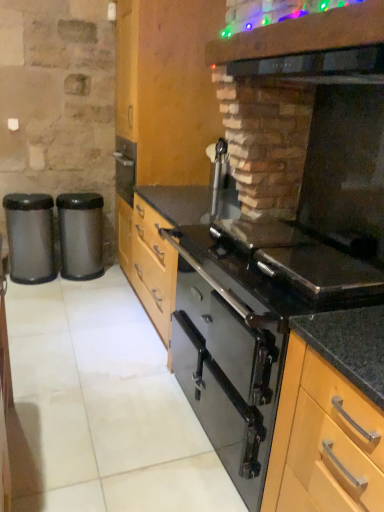
Question: Should I look upward or downward to see black glass oven at center?

Choices:
 (A) up
 (B) down

Answer: (B)

Question: From the image's perspective, is black glass oven at center over black glossy vent at upper center?

Choices:
 (A) yes
 (B) no

Answer: (B)

Question: From a real-world perspective, is black glass oven at center physically above black glossy vent at upper center?

Choices:
 (A) yes
 (B) no

Answer: (B)

Question: Does black glass oven at center come in front of black glossy vent at upper center?

Choices:
 (A) no
 (B) yes

Answer: (A)

Question: Can you confirm if black glass oven at center is bigger than black glossy vent at upper center?

Choices:
 (A) no
 (B) yes

Answer: (B)

Question: Is black glass oven at center far away from black glossy vent at upper center?

Choices:
 (A) no
 (B) yes

Answer: (A)

Question: Can you confirm if black glass oven at center is thinner than black glossy vent at upper center?

Choices:
 (A) yes
 (B) no

Answer: (B)

Question: Is metallic trash can at left, marked as the second waste container in a right-to-left arrangement, turned away from black glass exhaust hood at upper right?

Choices:
 (A) yes
 (B) no

Answer: (B)

Question: From the image's perspective, is metallic trash can at left, marked as the second waste container in a right-to-left arrangement, over black glass exhaust hood at upper right?

Choices:
 (A) yes
 (B) no

Answer: (B)

Question: Is metallic trash can at left, marked as the second waste container in a right-to-left arrangement, shorter than black glass exhaust hood at upper right?

Choices:
 (A) no
 (B) yes

Answer: (A)

Question: Is metallic trash can at left, marked as the second waste container in a right-to-left arrangement, beside black glass exhaust hood at upper right?

Choices:
 (A) yes
 (B) no

Answer: (B)

Question: Considering the relative positions of metallic trash can at left, which ranks as the 1th waste container in left-to-right order, and black glass exhaust hood at upper right in the image provided, is metallic trash can at left, which ranks as the 1th waste container in left-to-right order, in front of black glass exhaust hood at upper right?

Choices:
 (A) yes
 (B) no

Answer: (B)

Question: Considering the relative sizes of metallic trash can at left, which ranks as the 1th waste container in left-to-right order, and black glass exhaust hood at upper right in the image provided, is metallic trash can at left, which ranks as the 1th waste container in left-to-right order, wider than black glass exhaust hood at upper right?

Choices:
 (A) yes
 (B) no

Answer: (B)

Question: Does light wood cabinet at center, arranged as the 2th cabinetry when viewed from the left, appear on the right side of black glass oven at center?

Choices:
 (A) yes
 (B) no

Answer: (A)